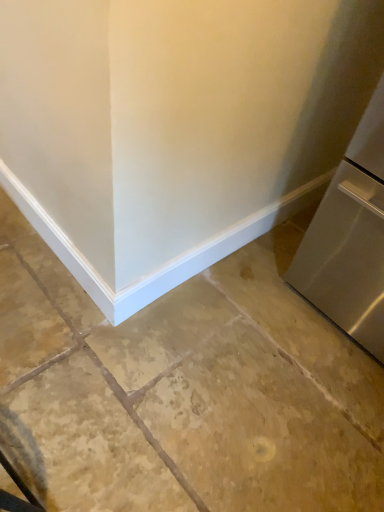
Question: Could you tell me if brown stone floor at center is facing satin silver refrigerator at right?

Choices:
 (A) yes
 (B) no

Answer: (B)

Question: Does brown stone floor at center come behind satin silver refrigerator at right?

Choices:
 (A) yes
 (B) no

Answer: (A)

Question: Is brown stone floor at center not close to satin silver refrigerator at right?

Choices:
 (A) yes
 (B) no

Answer: (B)

Question: Does brown stone floor at center appear on the left side of satin silver refrigerator at right?

Choices:
 (A) no
 (B) yes

Answer: (B)

Question: Considering the relative sizes of brown stone floor at center and satin silver refrigerator at right in the image provided, is brown stone floor at center wider than satin silver refrigerator at right?

Choices:
 (A) yes
 (B) no

Answer: (A)

Question: From the image's perspective, is brown stone floor at center under satin silver refrigerator at right?

Choices:
 (A) yes
 (B) no

Answer: (A)

Question: Does satin silver refrigerator at right have a greater height compared to brown stone floor at center?

Choices:
 (A) yes
 (B) no

Answer: (A)

Question: Is satin silver refrigerator at right turned away from brown stone floor at center?

Choices:
 (A) no
 (B) yes

Answer: (A)

Question: Does satin silver refrigerator at right have a larger size compared to brown stone floor at center?

Choices:
 (A) no
 (B) yes

Answer: (B)

Question: Can you confirm if satin silver refrigerator at right is positioned to the left of brown stone floor at center?

Choices:
 (A) yes
 (B) no

Answer: (B)

Question: Is satin silver refrigerator at right thinner than brown stone floor at center?

Choices:
 (A) no
 (B) yes

Answer: (B)

Question: Is satin silver refrigerator at right further to camera compared to brown stone floor at center?

Choices:
 (A) no
 (B) yes

Answer: (A)

Question: From the image's perspective, is satin silver refrigerator at right located above or below brown stone floor at center?

Choices:
 (A) below
 (B) above

Answer: (B)